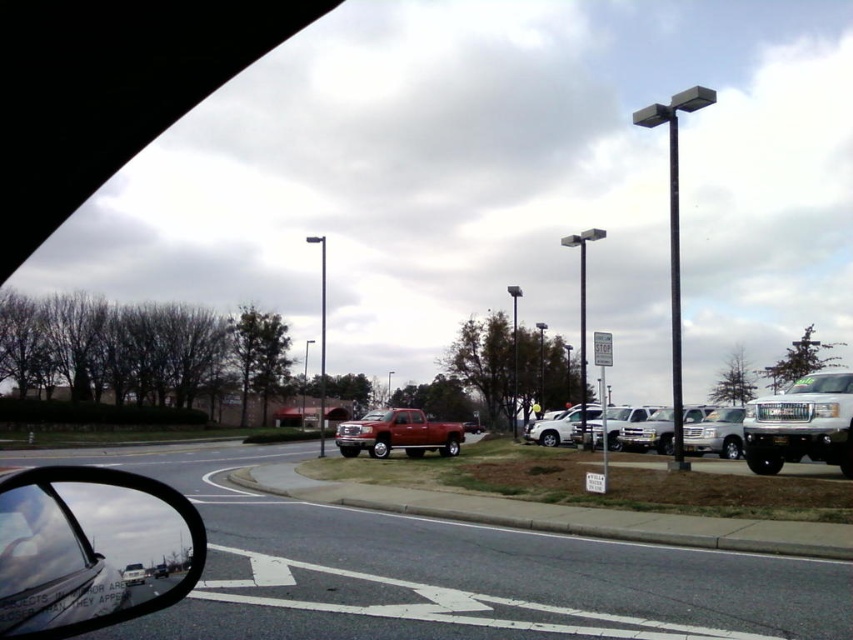
Can you confirm if shiny red truck at center is wider than satin silver suv at center?

Indeed, shiny red truck at center has a greater width compared to satin silver suv at center.

Looking at this image, can you confirm if shiny red truck at center is taller than satin silver suv at center?

Yes, shiny red truck at center is taller than satin silver suv at center.

Is point (344, 451) farther from viewer compared to point (578, 417)?

No, (344, 451) is in front of (578, 417).

This screenshot has width=853, height=640. What are the coordinates of `shiny red truck at center` in the screenshot? It's located at (397, 433).

Who is positioned more to the left, silver metallic suv at right or satin silver suv at center?

Positioned to the left is satin silver suv at center.

Between silver metallic suv at right and satin silver suv at center, which one appears on the right side from the viewer's perspective?

From the viewer's perspective, silver metallic suv at right appears more on the right side.

Which is behind, point (740, 412) or point (540, 419)?

The point (540, 419) is behind.

Locate an element on the screen. The width and height of the screenshot is (853, 640). silver metallic suv at right is located at coordinates (715, 433).

Can you confirm if shiny red truck at center is positioned below silver metallic suv at right?

Yes.

Between shiny red truck at center and silver metallic suv at right, which one has more height?

shiny red truck at center is taller.

At what (x,y) coordinates should I click in order to perform the action: click on shiny red truck at center. Please return your answer as a coordinate pair (x, y). Looking at the image, I should click on (397, 433).